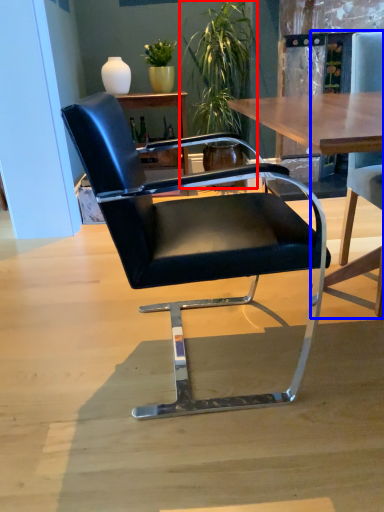
Question: Which of the following is the closest to the observer, houseplant (highlighted by a red box) or chair (highlighted by a blue box)?

Choices:
 (A) houseplant
 (B) chair

Answer: (B)